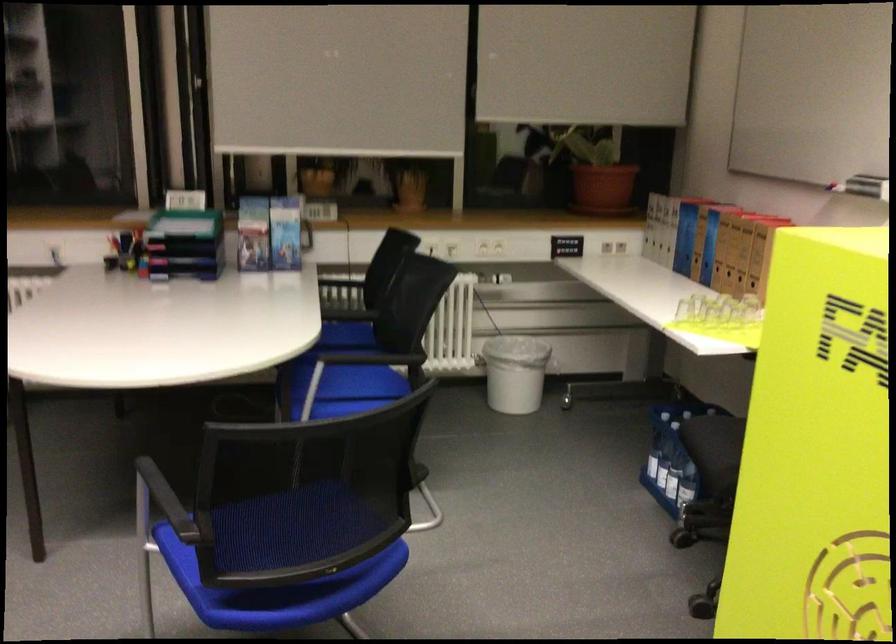
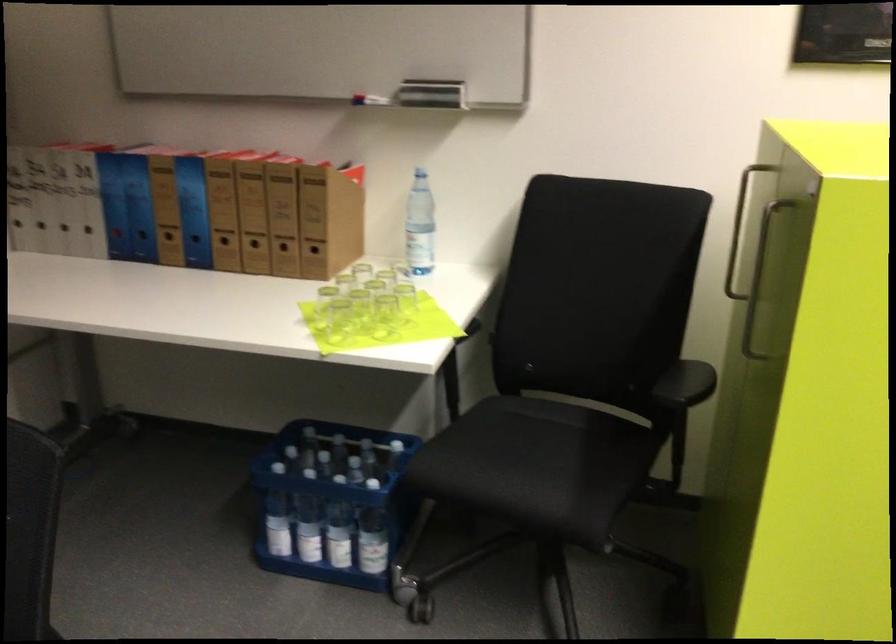
Find the pixel in the second image that matches [738,279] in the first image.

(283, 252)